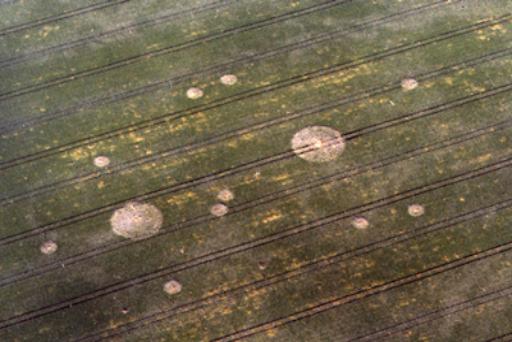
Find the location of a particular element. This screenshot has width=512, height=342. planks is located at coordinates (443, 210), (422, 140), (378, 76), (327, 17), (120, 26).